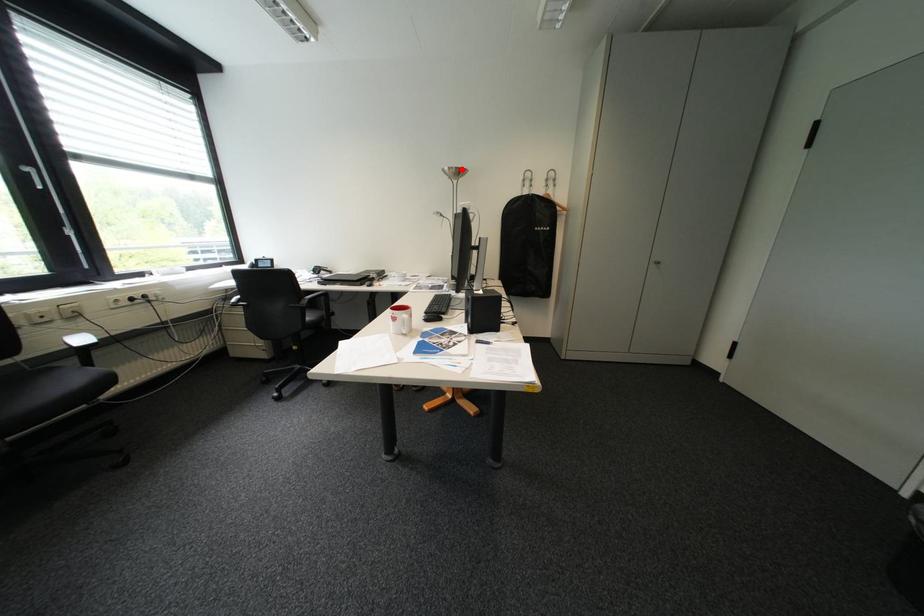
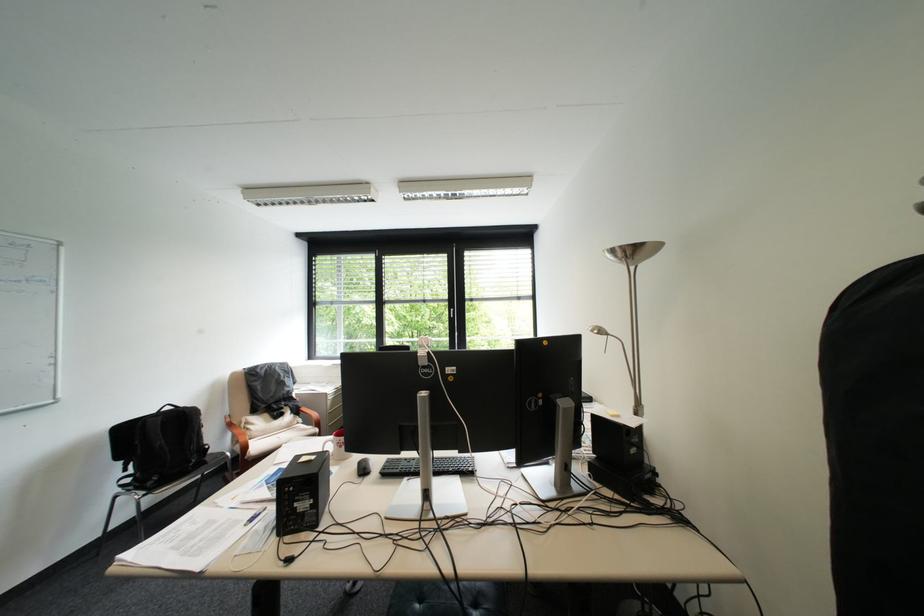
Question: I am providing you with two images of the same scene from different viewpoints. In image1, a red point is highlighted. Considering the same 3D point in image2, which of the following is correct?

Choices:
 (A) It is closer
 (B) It is farther

Answer: (B)